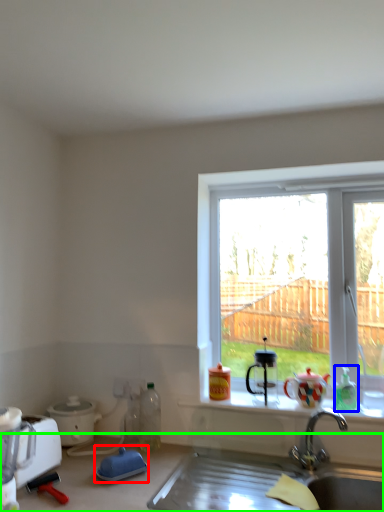
Question: Considering the real-world distances, which object is farthest from appliance (highlighted by a red box)? bottle (highlighted by a blue box) or countertop (highlighted by a green box)?

Choices:
 (A) bottle
 (B) countertop

Answer: (A)